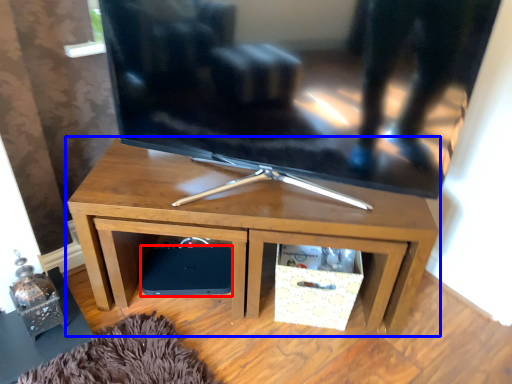
Question: Among these objects, which one is nearest to the camera, speaker (highlighted by a red box) or desk (highlighted by a blue box)?

Choices:
 (A) speaker
 (B) desk

Answer: (B)